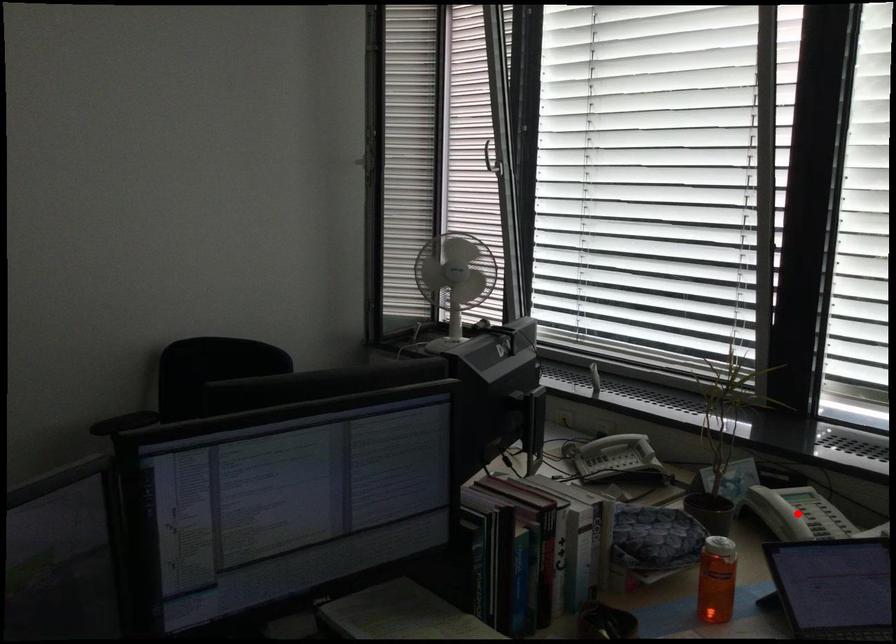
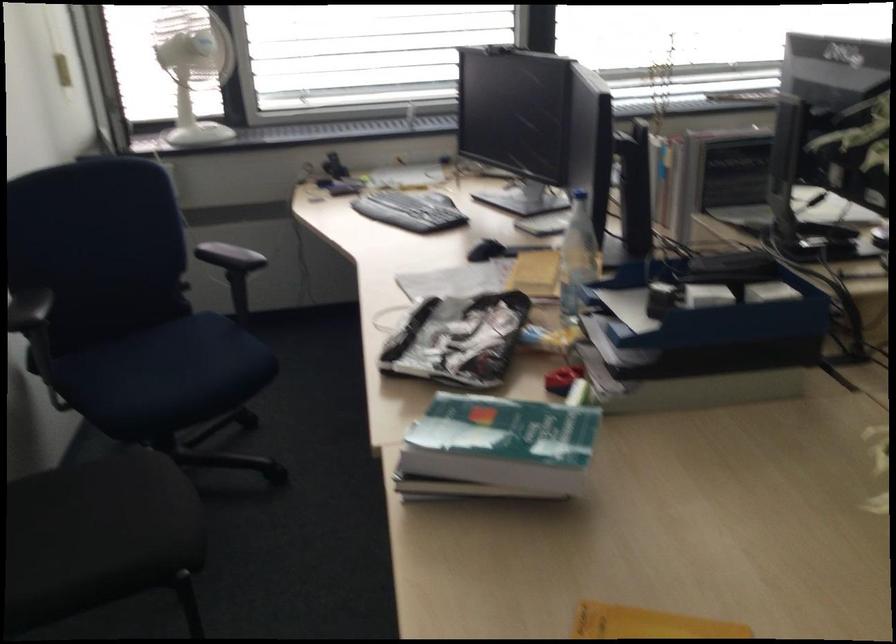
Question: I am providing you with two images of the same scene from different viewpoints. A red point is marked on the first image. Can you still see the location of the red point in image 2?

Choices:
 (A) Yes
 (B) No

Answer: (B)